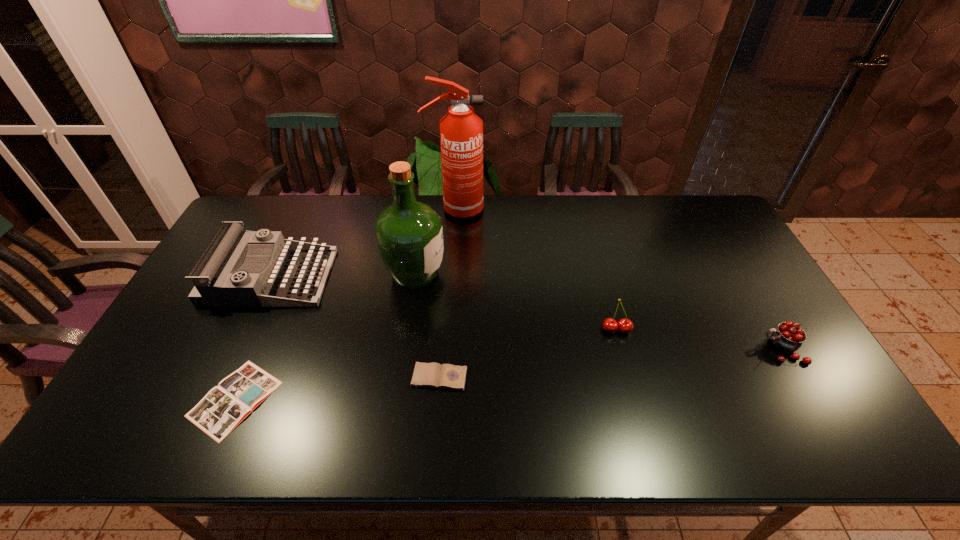
The width and height of the screenshot is (960, 540). I want to click on book situated at the left edge, so click(224, 407).

Find the location of `object located in the right edge section of the desktop`. object located in the right edge section of the desktop is located at coordinates (788, 337).

Find the location of a particular element. object situated at the near left corner is located at coordinates (224, 407).

The height and width of the screenshot is (540, 960). I want to click on vacant space at the far edge, so click(440, 199).

This screenshot has height=540, width=960. I want to click on free space at the near edge of the desktop, so click(x=535, y=420).

You are a GUI agent. You are given a task and a screenshot of the screen. Output one action in this format:
    pyautogui.click(x=<x>, y=<y>)
    Task: Click on the vacant space at the left edge of the desktop
    Image resolution: width=960 pixels, height=540 pixels.
    Given the screenshot: What is the action you would take?
    pyautogui.click(x=183, y=400)

You are a GUI agent. You are given a task and a screenshot of the screen. Output one action in this format:
    pyautogui.click(x=<x>, y=<y>)
    Task: Click on the vacant space at the right edge
    Image resolution: width=960 pixels, height=540 pixels.
    Given the screenshot: What is the action you would take?
    pyautogui.click(x=735, y=241)

At what (x,y) coordinates should I click in order to perform the action: click on vacant region at the far left corner of the desktop. Please return your answer as a coordinate pair (x, y). Image resolution: width=960 pixels, height=540 pixels. Looking at the image, I should click on (238, 220).

This screenshot has height=540, width=960. In order to click on free region at the far right corner of the desktop in this screenshot , I will do `click(684, 213)`.

What are the coordinates of `vacant area that lies between the book and the diary` in the screenshot? It's located at (337, 388).